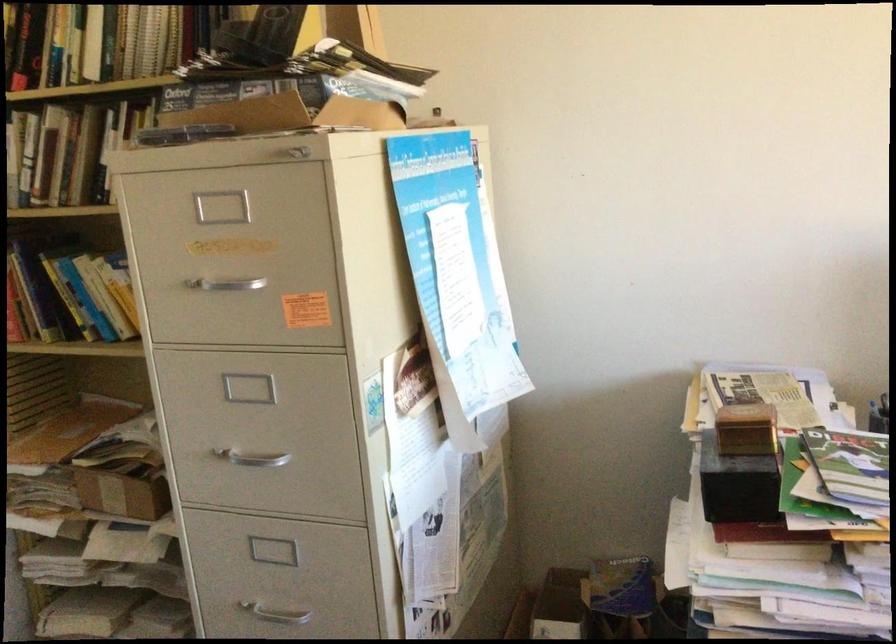
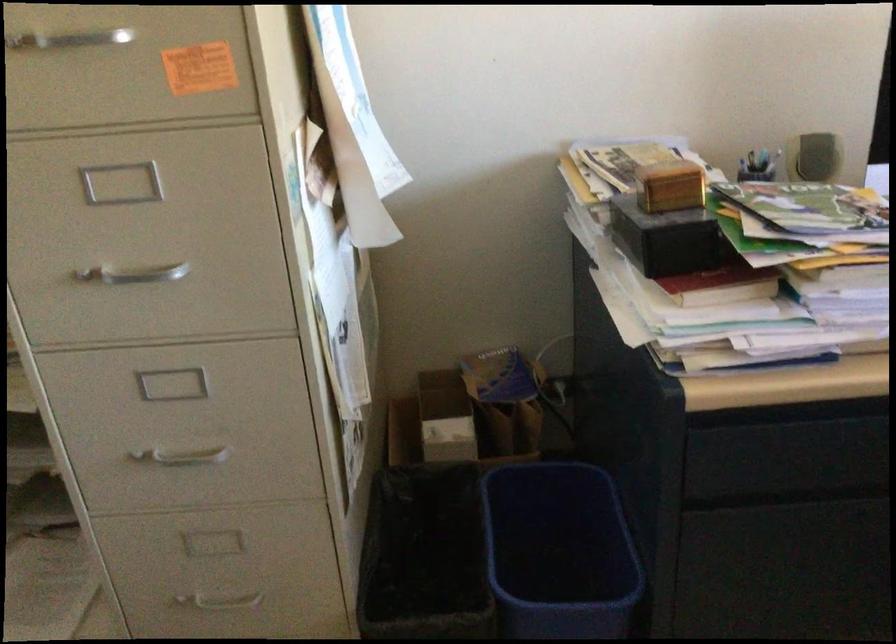
Where in the second image is the point corresponding to point (728, 482) from the first image?

(668, 239)